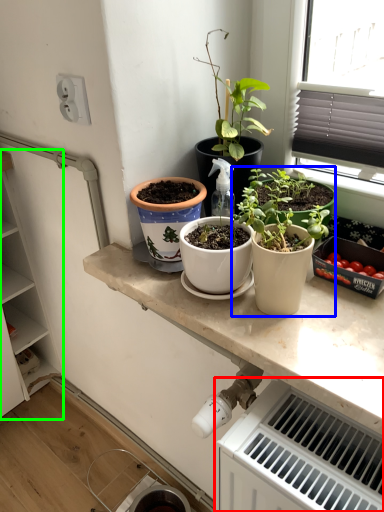
Question: Estimate the real-world distances between objects in this image. Which object is closer to radiator (highlighted by a red box), houseplant (highlighted by a blue box) or cabinetry (highlighted by a green box)?

Choices:
 (A) houseplant
 (B) cabinetry

Answer: (A)